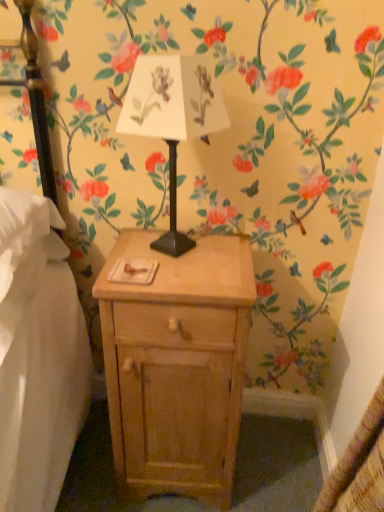
Describe the element at coordinates (172, 118) in the screenshot. I see `white paper lampshade at center` at that location.

Find the location of a particular element. This screenshot has width=384, height=512. white paper lampshade at center is located at coordinates (172, 118).

What do you see at coordinates (177, 366) in the screenshot? This screenshot has width=384, height=512. I see `light wood nightstand at center` at bounding box center [177, 366].

You are a GUI agent. You are given a task and a screenshot of the screen. Output one action in this format:
    pyautogui.click(x=<x>, y=<y>)
    Task: Click on the light wood nightstand at center
    
    Given the screenshot: What is the action you would take?
    pyautogui.click(x=177, y=366)

I want to click on white paper lampshade at center, so click(x=172, y=118).

Is white paper lampshade at center to the left or to the right of light wood nightstand at center in the image?

white paper lampshade at center is positioned on light wood nightstand at center's left side.

In the image, is white paper lampshade at center positioned in front of or behind light wood nightstand at center?

Visually, white paper lampshade at center is located in front of light wood nightstand at center.

Between point (157, 92) and point (207, 362), which one is positioned behind?

The point (207, 362) is farther from the camera.

From the image's perspective, between white paper lampshade at center and light wood nightstand at center, who is located below?

light wood nightstand at center appears lower in the image.

From a real-world perspective, is white paper lampshade at center above or below light wood nightstand at center?

From a real-world perspective, white paper lampshade at center is physically above light wood nightstand at center.

Can you confirm if white paper lampshade at center is thinner than light wood nightstand at center?

Indeed, white paper lampshade at center has a lesser width compared to light wood nightstand at center.

From their relative heights in the image, would you say white paper lampshade at center is taller or shorter than light wood nightstand at center?

In the image, white paper lampshade at center appears to be shorter than light wood nightstand at center.

Considering the sizes of objects white paper lampshade at center and light wood nightstand at center in the image provided, who is smaller, white paper lampshade at center or light wood nightstand at center?

Smaller between the two is white paper lampshade at center.

Would you say white paper lampshade at center is inside or outside light wood nightstand at center?

white paper lampshade at center is spatially situated outside light wood nightstand at center.

Can you see white paper lampshade at center touching light wood nightstand at center?

No, white paper lampshade at center is not making contact with light wood nightstand at center.

Is white paper lampshade at center aimed at light wood nightstand at center?

No.

How many degrees apart are the facing directions of white paper lampshade at center and light wood nightstand at center?

The facing directions of white paper lampshade at center and light wood nightstand at center are 29.3 degrees apart.

This screenshot has width=384, height=512. What are the coordinates of `nightstand below the white paper lampshade at center (from the image's perspective)` in the screenshot? It's located at [177, 366].

Between light wood nightstand at center and white paper lampshade at center, which one appears on the right side from the viewer's perspective?

Positioned to the right is light wood nightstand at center.

Between light wood nightstand at center and white paper lampshade at center, which one is positioned in front?

white paper lampshade at center.

Considering the positions of point (192, 488) and point (212, 88), is point (192, 488) closer or farther from the camera than point (212, 88)?

Point (192, 488) appears to be farther away from the viewer than point (212, 88).

Consider the image. From the image's perspective, is light wood nightstand at center positioned above or below white paper lampshade at center?

light wood nightstand at center is situated lower than white paper lampshade at center in the image.

From a real-world perspective, who is located higher, light wood nightstand at center or white paper lampshade at center?

white paper lampshade at center, from a real-world perspective.

Is light wood nightstand at center wider than white paper lampshade at center?

Yes.

Does light wood nightstand at center have a lesser height compared to white paper lampshade at center?

Incorrect, the height of light wood nightstand at center does not fall short of that of white paper lampshade at center.

Looking at the image, does light wood nightstand at center seem bigger or smaller compared to white paper lampshade at center?

Considering their sizes, light wood nightstand at center takes up more space than white paper lampshade at center.

Would you say light wood nightstand at center is outside white paper lampshade at center?

Yes, light wood nightstand at center is outside of white paper lampshade at center.

Is light wood nightstand at center with white paper lampshade at center?

No.

Is light wood nightstand at center turned away from white paper lampshade at center?

No, white paper lampshade at center is not at the back of light wood nightstand at center.

What's the angular difference between light wood nightstand at center and white paper lampshade at center's facing directions?

light wood nightstand at center and white paper lampshade at center are facing 29.3 degrees away from each other.

The height and width of the screenshot is (512, 384). Identify the location of table lamp located in front of the light wood nightstand at center. tap(172, 118).

The width and height of the screenshot is (384, 512). Identify the location of table lamp that is above the light wood nightstand at center (from a real-world perspective). (172, 118).

In order to click on table lamp on the left side of light wood nightstand at center in this screenshot , I will do `click(172, 118)`.